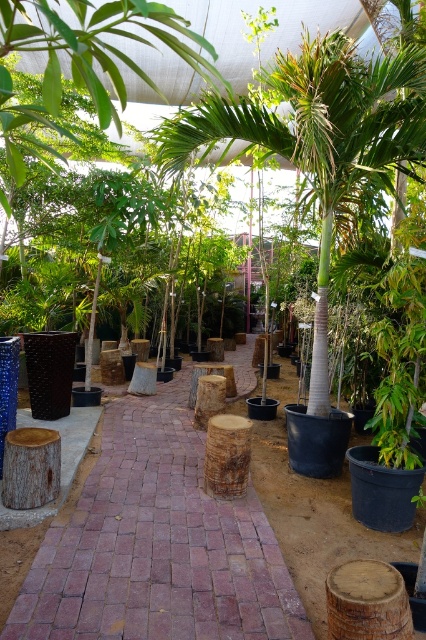
You are a gardener who needs to move a large potted plant from one side of the brick paved path at center to the other side. Considering the height of the green leafy palm tree at center, will the palm tree obstruct your path?

The brick paved path at center is shorter than the green leafy palm tree at center, so the palm tree will not obstruct your path since the path is lower than the tree.